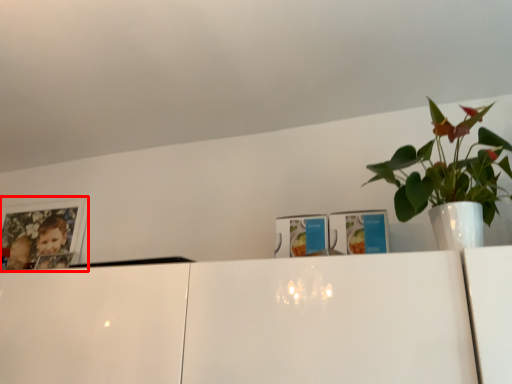
Question: Observing the image, what is the correct spatial positioning of picture frame (annotated by the red box) in reference to houseplant?

Choices:
 (A) right
 (B) left

Answer: (B)